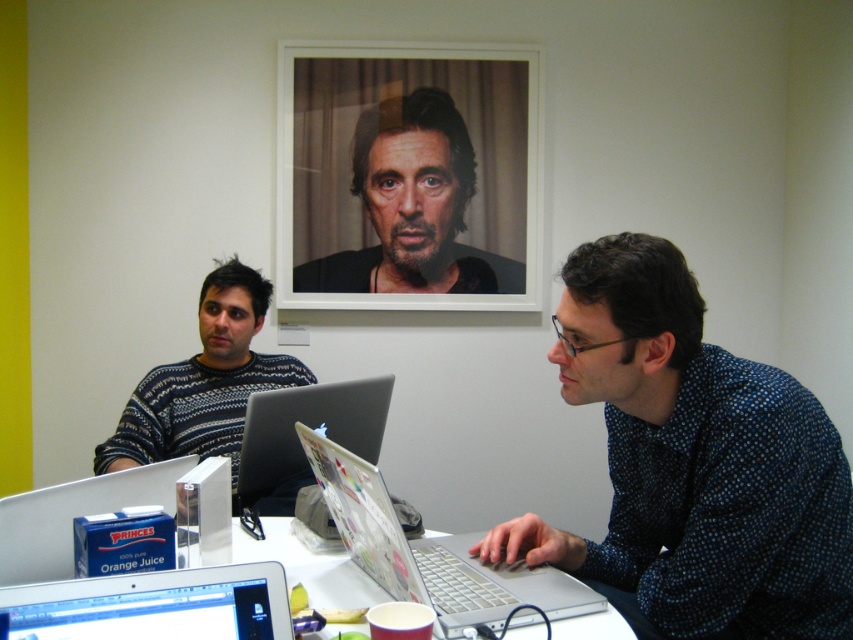
Question: Can you confirm if silver metallic laptop at center is positioned above satin silver laptop at center?

Choices:
 (A) no
 (B) yes

Answer: (A)

Question: Where is white matte picture frame at upper center located in relation to silver metallic laptop at center in the image?

Choices:
 (A) left
 (B) right

Answer: (A)

Question: Which of the following is the closest to the observer?

Choices:
 (A) white matte picture frame at upper center
 (B) blue dotted shirt at center

Answer: (B)

Question: Which object is positioned farthest from the white plastic table at center?

Choices:
 (A) satin silver laptop at center
 (B) silver metallic laptop at center
 (C) metallic silver laptop at lower left

Answer: (A)

Question: Observing the image, what is the correct spatial positioning of silver metallic laptop at center in reference to silver metallic laptop at lower left?

Choices:
 (A) right
 (B) left

Answer: (A)

Question: Which is farther from the silver metallic laptop at lower left?

Choices:
 (A) white matte picture frame at upper center
 (B) blue dotted shirt at center

Answer: (A)